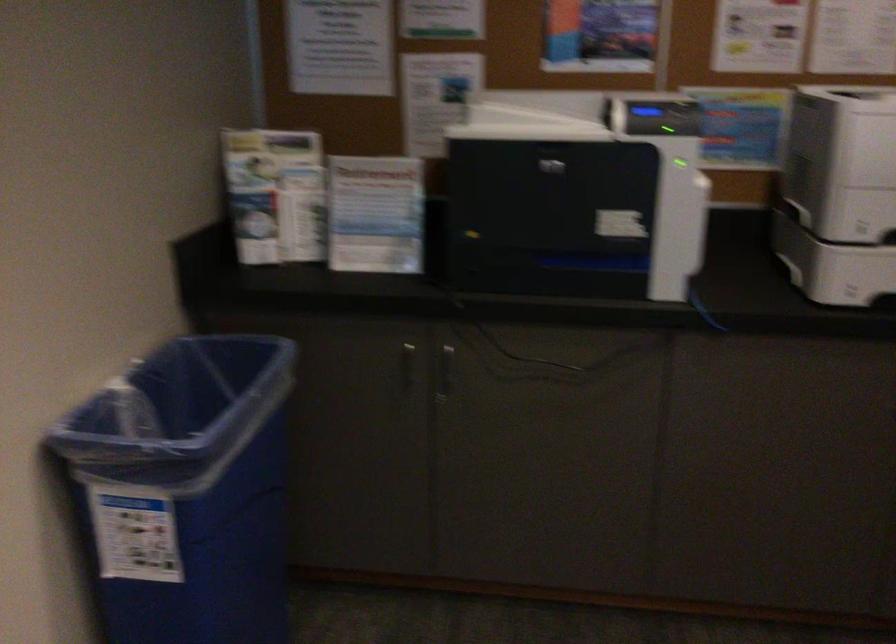
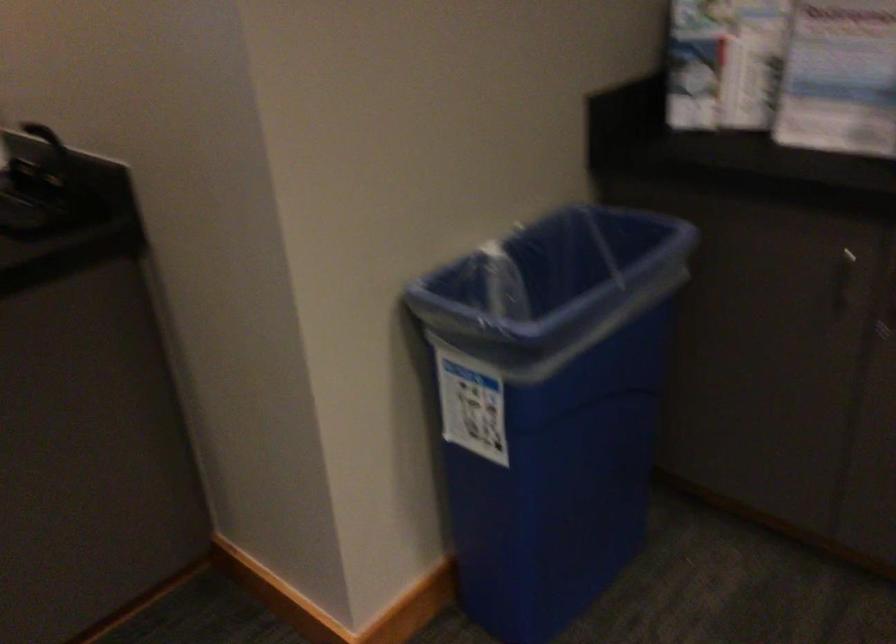
Question: The images are taken continuously from a first-person perspective. In which direction is your viewpoint rotating?

Choices:
 (A) Left
 (B) Right
 (C) Up
 (D) Down

Answer: (A)